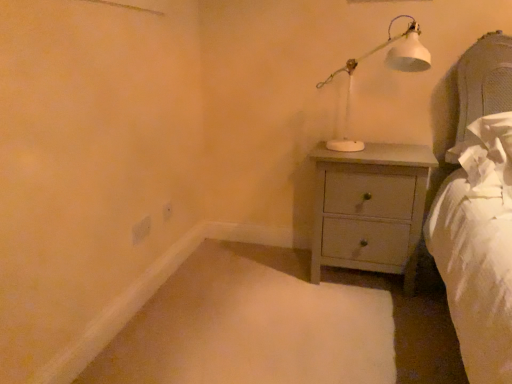
You are a GUI agent. You are given a task and a screenshot of the screen. Output one action in this format:
    pyautogui.click(x=<x>, y=<y>)
    Task: Click on the free space above light gray wood chest of drawers at center-right (from a real-world perspective)
    This screenshot has height=384, width=512.
    Given the screenshot: What is the action you would take?
    pyautogui.click(x=365, y=150)